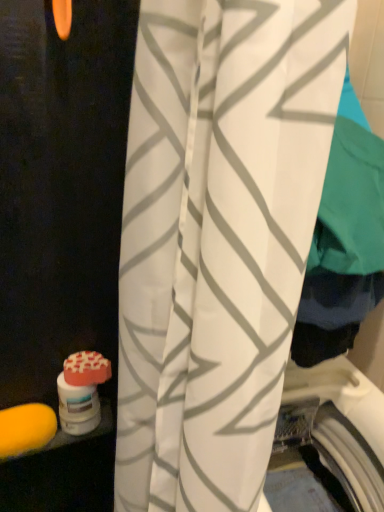
Question: From a real-world perspective, is yellow sponge at lower left, the 1th soap in the left-to-right sequence, positioned under orange matte soap at lower left, the 2th soap from the bottom, based on gravity?

Choices:
 (A) yes
 (B) no

Answer: (A)

Question: Does yellow sponge at lower left, the 2th soap in the right-to-left sequence, have a lesser width compared to orange matte soap at lower left, which is the second soap in left-to-right order?

Choices:
 (A) yes
 (B) no

Answer: (B)

Question: Does yellow sponge at lower left, the 1th soap in the left-to-right sequence, appear on the left side of orange matte soap at lower left, arranged as the first soap when viewed from the right?

Choices:
 (A) no
 (B) yes

Answer: (B)

Question: Is yellow sponge at lower left, placed as the first soap when sorted from bottom to top, behind orange matte soap at lower left, which is the second soap in left-to-right order?

Choices:
 (A) no
 (B) yes

Answer: (A)

Question: Considering the relative sizes of yellow sponge at lower left, the 2th soap in the right-to-left sequence, and orange matte soap at lower left, arranged as the first soap when viewed from the right, in the image provided, is yellow sponge at lower left, the 2th soap in the right-to-left sequence, wider than orange matte soap at lower left, arranged as the first soap when viewed from the right,?

Choices:
 (A) yes
 (B) no

Answer: (A)

Question: Based on their sizes in the image, would you say white fabric curtain at center is bigger or smaller than yellow sponge at lower left, the 1th soap in the left-to-right sequence?

Choices:
 (A) big
 (B) small

Answer: (A)

Question: From a real-world perspective, is white fabric curtain at center positioned above or below yellow sponge at lower left, the 2th soap in the right-to-left sequence?

Choices:
 (A) below
 (B) above

Answer: (B)

Question: From their relative heights in the image, would you say white fabric curtain at center is taller or shorter than yellow sponge at lower left, the 2th soap in the right-to-left sequence?

Choices:
 (A) short
 (B) tall

Answer: (B)

Question: Would you say white fabric curtain at center is to the left or to the right of yellow sponge at lower left, the 2th soap in the right-to-left sequence, in the picture?

Choices:
 (A) left
 (B) right

Answer: (B)

Question: Would you say orange matte soap at lower left, which is the second soap in left-to-right order, is to the left or to the right of white fabric curtain at center in the picture?

Choices:
 (A) right
 (B) left

Answer: (B)

Question: Looking at their shapes, would you say orange matte soap at lower left, which appears as the 1th soap when viewed from the top, is wider or thinner than white fabric curtain at center?

Choices:
 (A) thin
 (B) wide

Answer: (A)

Question: From the image's perspective, is orange matte soap at lower left, which is the second soap in left-to-right order, above or below white fabric curtain at center?

Choices:
 (A) above
 (B) below

Answer: (B)

Question: Which is correct: orange matte soap at lower left, arranged as the first soap when viewed from the right, is inside white fabric curtain at center, or outside of it?

Choices:
 (A) outside
 (B) inside

Answer: (A)

Question: Based on their sizes in the image, would you say orange matte soap at lower left, the 2th soap from the bottom, is bigger or smaller than yellow sponge at lower left, which is the second soap in top-to-bottom order?

Choices:
 (A) small
 (B) big

Answer: (A)

Question: From a real-world perspective, relative to yellow sponge at lower left, the 2th soap in the right-to-left sequence, is orange matte soap at lower left, which appears as the 1th soap when viewed from the top, vertically above or below?

Choices:
 (A) above
 (B) below

Answer: (A)